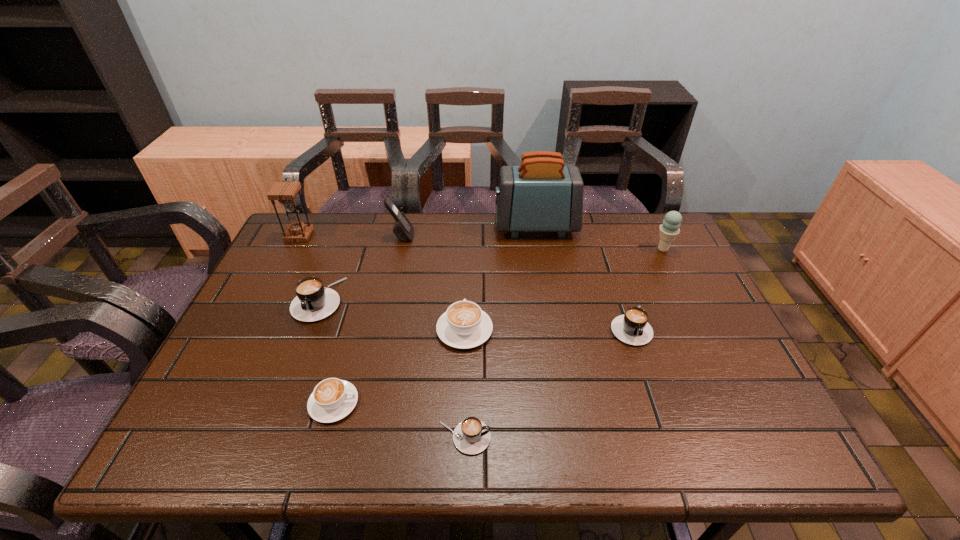
What are the coordinates of `vacant space located on the right of the second tallest object` in the screenshot? It's located at (329, 235).

Locate an element on the screen. The height and width of the screenshot is (540, 960). free location located on the front-facing side of the cellular telephone is located at coordinates (442, 236).

The width and height of the screenshot is (960, 540). I want to click on vacant space located on the back of the ice cream, so click(x=653, y=228).

The image size is (960, 540). In order to click on free space located 0.080m with the handle on the side of the second object from left to right in this screenshot , I will do `click(300, 348)`.

The width and height of the screenshot is (960, 540). Identify the location of vacant space positioned 0.170m on the side of the farther white cappuccino with the handle. (467, 268).

What are the coordinates of `vacant space located on the side of the farther white cappuccino with the handle` in the screenshot? It's located at (468, 258).

In order to click on vacant space located on the side of the farther white cappuccino with the handle in this screenshot , I will do `click(466, 292)`.

Locate an element on the screen. The height and width of the screenshot is (540, 960). vacant space situated 0.270m with the handle on the side of the rightmost cappuccino is located at coordinates (672, 452).

Locate an element on the screen. vacant space located on the side of the left white cappuccino with the handle is located at coordinates (535, 403).

Locate an element on the screen. vacant space situated with the handle on the side of the second black cappuccino from right to left is located at coordinates (563, 437).